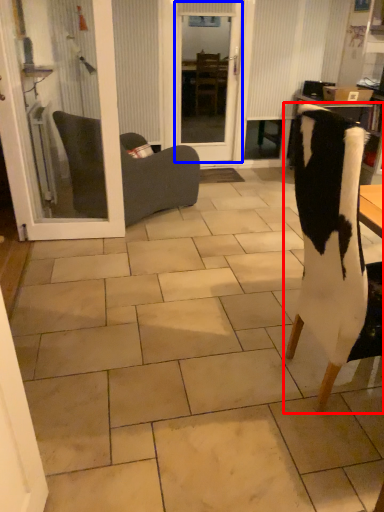
Question: Which object appears closest to the camera in this image, chair (highlighted by a red box) or screen door (highlighted by a blue box)?

Choices:
 (A) chair
 (B) screen door

Answer: (A)